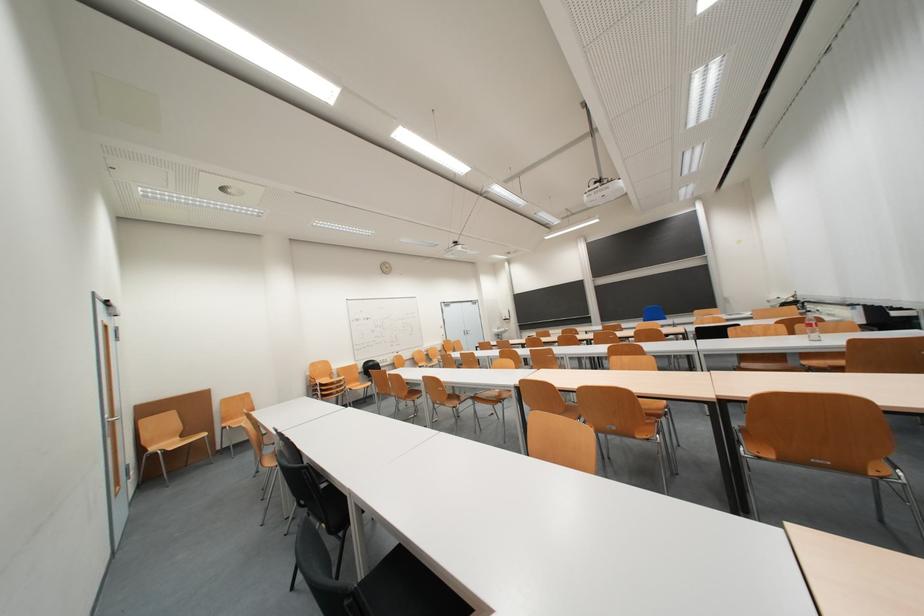
Identify the location of silver door handle. (112, 418).